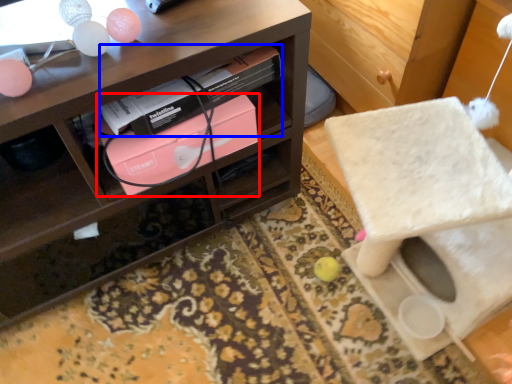
Question: Which object appears farthest to the camera in this image, box (highlighted by a red box) or book (highlighted by a blue box)?

Choices:
 (A) box
 (B) book

Answer: (A)